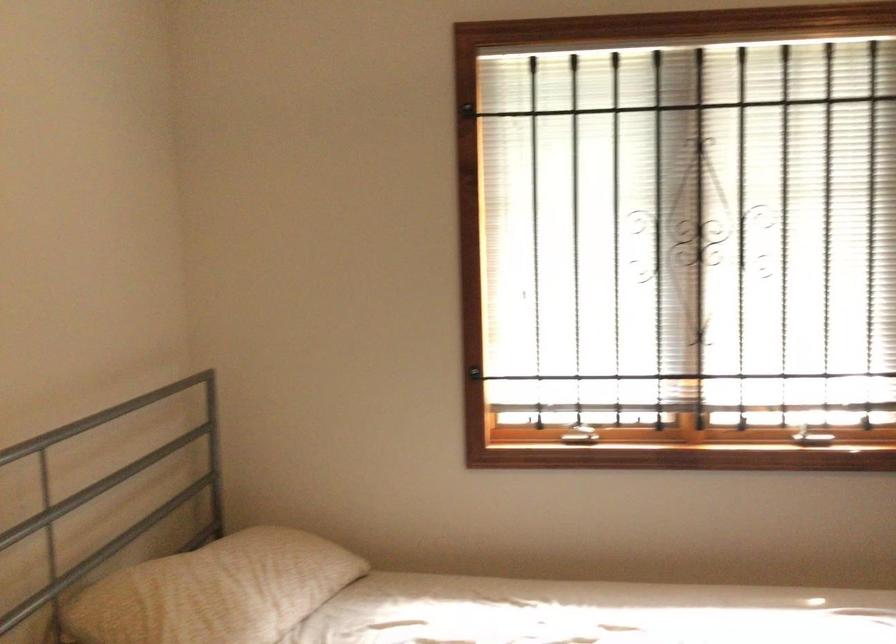
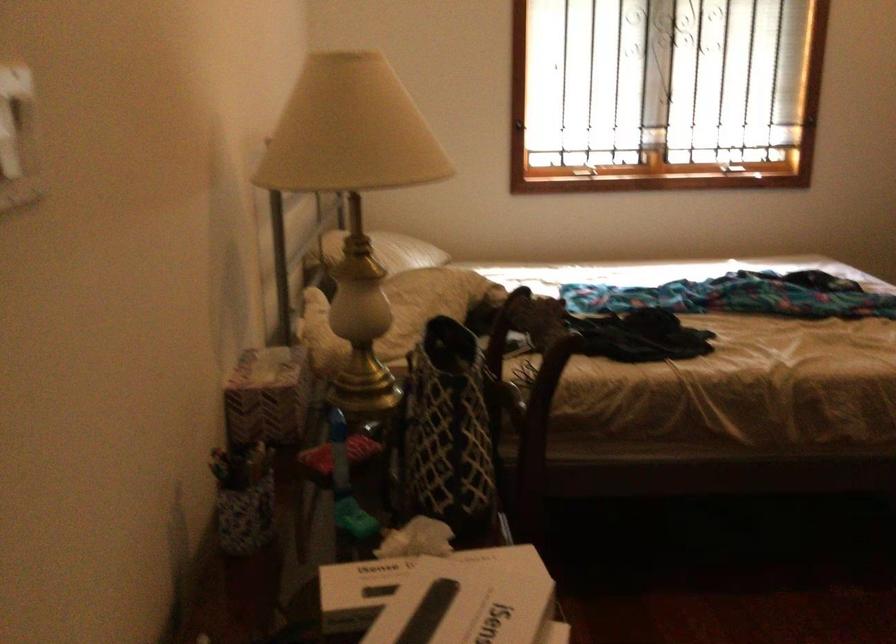
In a continuous first-person perspective shot, in which direction is the camera moving?

The movement direction of the cameraman is left, backward.